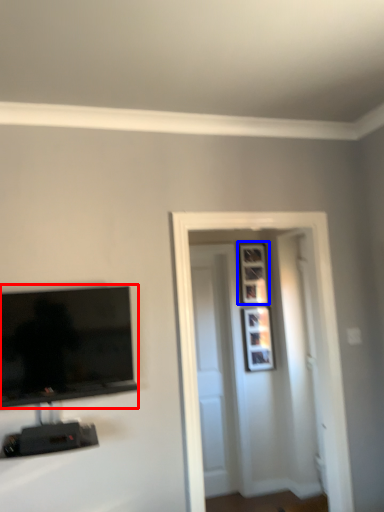
Question: Which object is further to the camera taking this photo, television (highlighted by a red box) or picture frame (highlighted by a blue box)?

Choices:
 (A) television
 (B) picture frame

Answer: (B)